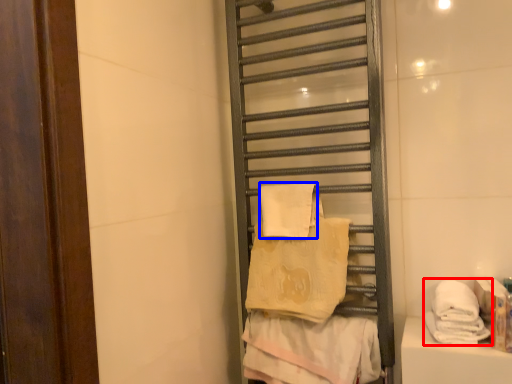
Question: Which object is closer to the camera taking this photo, towel (highlighted by a red box) or towel (highlighted by a blue box)?

Choices:
 (A) towel
 (B) towel

Answer: (A)